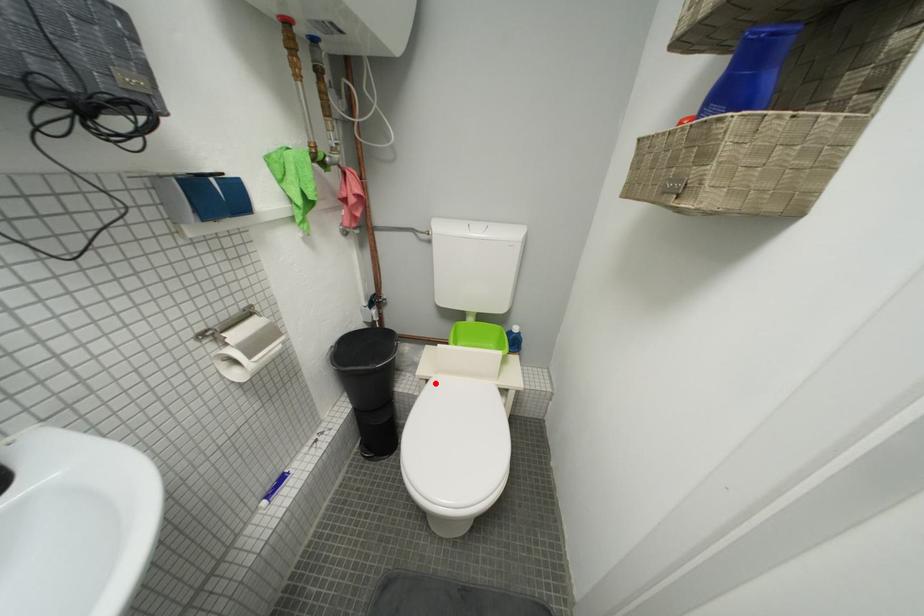
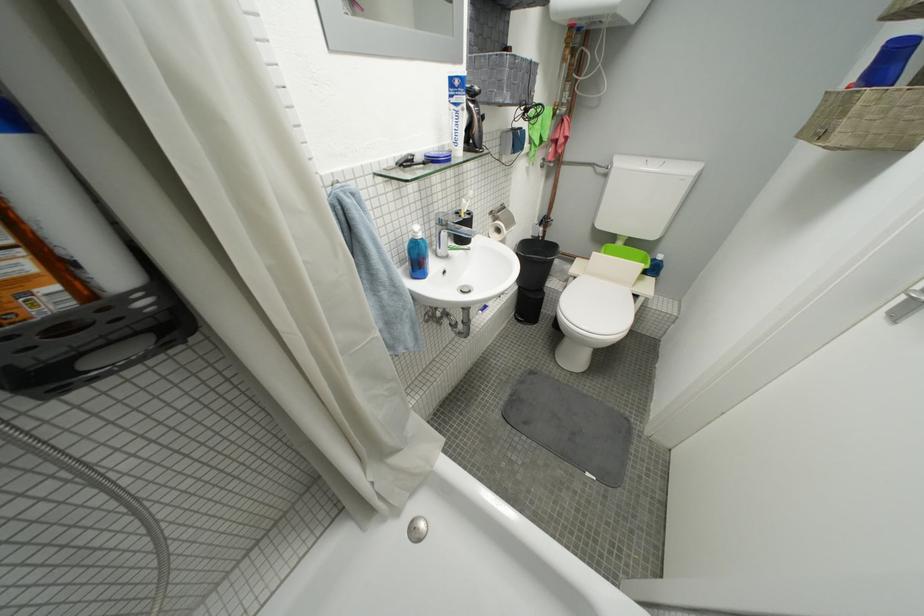
Question: A red point is marked in image1. In image2, is the corresponding 3D point closer to the camera or farther? Reply with the corresponding letter.

Choices:
 (A) The corresponding 3D point is closer.
 (B) The corresponding 3D point is farther.

Answer: (A)